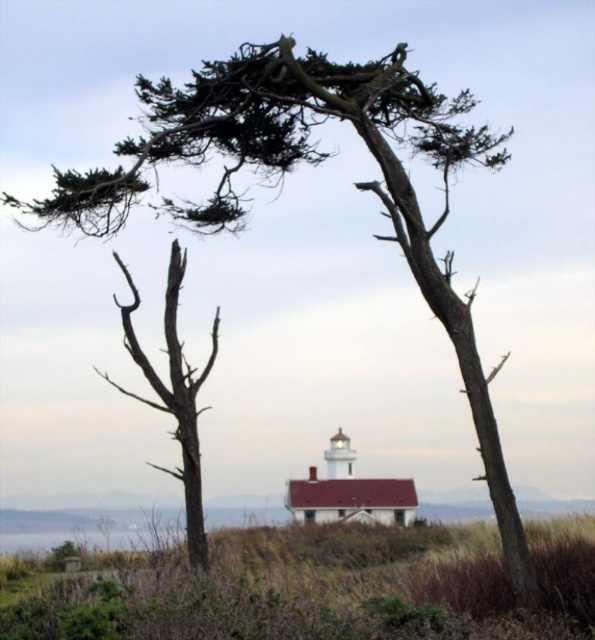
You are a photographer planning to take a photo of the lighthouse. You want to ensure both the bare wood tree at left and the transparent water at lower left are visible in the frame. Based on their positions, which object should be placed on the right side of the photo to include both?

The bare wood tree at left should be placed on the right side of the photo because it is already positioned to the right of the transparent water at lower left, allowing both to be included in the frame.

You are standing at the camera position and want to walk towards the bare wood tree at left. How far will you have to walk?

The bare wood tree at left is 18.01 meters away from camera, so you will have to walk 18.01 meters to reach it.

You are standing at the edge of the cliff overlooking the coast and see the bare wood tree at left and the transparent water at lower left. Which object is nearer to you?

The bare wood tree at left is closer to the viewer than the transparent water at lower left.